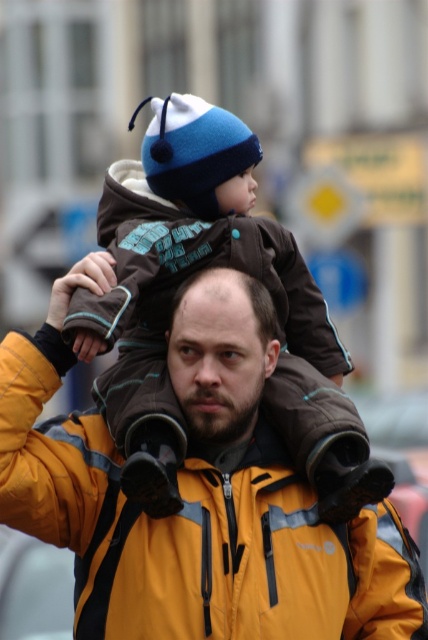
You are a photographer who needs to capture a clear shot of both the yellow puffy jacket at center and the brown fleece jacket at center. Based on their positions, which jacket should you focus on first to ensure both are in focus?

The yellow puffy jacket at center is below the brown fleece jacket at center. To ensure both are in focus, you should focus on the brown fleece jacket at center first since it is higher up, allowing the yellow puffy jacket at center to be captured in the depth of field below it.

You are a delivery person who needs to deliver a package to a man wearing a yellow puffy jacket at center. You see a point at coordinates (196, 497). Is this point on the man wearing the yellow puffy jacket at center?

Yes, the point at coordinates (196, 497) is on the yellow puffy jacket at center, so the delivery person can confirm that the package should be delivered to the man wearing the yellow puffy jacket at center.

You are a photographer trying to capture a candid shot of the yellow puffy jacket at center and the dark brown hair at center in the image. Since you want to ensure both subjects are in focus, you need to know their relative heights. Which one is taller?

The yellow puffy jacket at center is much taller as dark brown hair at center, so you should adjust your camera settings to focus on the taller subject first.